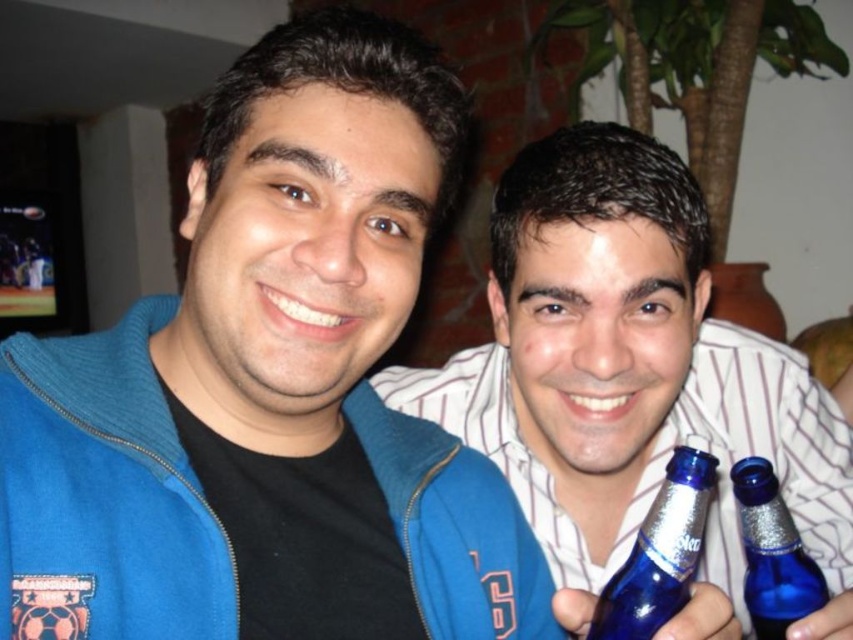
Can you confirm if blue zip-up jacket at center is wider than blue glass bottle at center?

Incorrect, blue zip-up jacket at center's width does not surpass blue glass bottle at center's.

Who is more distant from viewer, (x=187, y=292) or (x=554, y=406)?

Point (x=554, y=406)

Locate an element on the screen. This screenshot has height=640, width=853. blue zip-up jacket at center is located at coordinates (270, 388).

Is blue glass bottle at lower right further to the viewer compared to blue glass bottle at right?

No, blue glass bottle at lower right is in front of blue glass bottle at right.

Does blue glass bottle at lower right appear over blue glass bottle at right?

Indeed, blue glass bottle at lower right is positioned over blue glass bottle at right.

Who is more distant from viewer, (x=660, y=506) or (x=770, y=621)?

The point (x=770, y=621) is behind.

Find the location of a particular element. Image resolution: width=853 pixels, height=640 pixels. blue glass bottle at lower right is located at coordinates (659, 554).

Is blue glass bottle at center taller than blue glass bottle at lower right?

Yes.

Measure the distance between blue glass bottle at center and camera.

blue glass bottle at center and camera are 25.02 inches apart.

Between point (581, 280) and point (671, 508), which one is positioned behind?

Point (581, 280)

Find the location of a particular element. The image size is (853, 640). blue glass bottle at center is located at coordinates (630, 371).